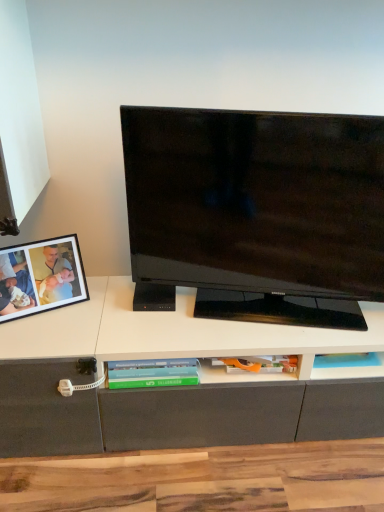
What is the approximate width of matte black picture frame at left?

It is 1.71 inches.

This screenshot has width=384, height=512. What do you see at coordinates (153, 373) in the screenshot?
I see `green matte book at center` at bounding box center [153, 373].

The image size is (384, 512). Describe the element at coordinates (256, 213) in the screenshot. I see `black glossy television at center` at that location.

The height and width of the screenshot is (512, 384). In order to click on matte black picture frame at left in this screenshot , I will do `click(41, 277)`.

Visually, is black glossy television at center positioned to the left or to the right of green matte book at center?

Clearly, black glossy television at center is on the right of green matte book at center in the image.

Is black glossy television at center oriented towards green matte book at center?

No, black glossy television at center does not turn towards green matte book at center.

Looking at their sizes, would you say matte black picture frame at left is wider or thinner than black glossy television at center?

matte black picture frame at left is thinner than black glossy television at center.

Considering the sizes of objects matte black picture frame at left and black glossy television at center in the image provided, who is smaller, matte black picture frame at left or black glossy television at center?

matte black picture frame at left.

From a real-world perspective, is matte black picture frame at left positioned over black glossy television at center based on gravity?

No, from a real-world perspective, matte black picture frame at left is not on top of black glossy television at center.

Based on the photo, in terms of height, does matte black picture frame at left look taller or shorter compared to black glossy television at center?

In the image, matte black picture frame at left appears to be shorter than black glossy television at center.

Which of these two, black glossy television at center or matte black picture frame at left, is wider?

black glossy television at center is wider.

Is black glossy television at center not inside matte black picture frame at left?

Absolutely, black glossy television at center is external to matte black picture frame at left.

Is black glossy television at center aimed at matte black picture frame at left?

No, black glossy television at center is not oriented towards matte black picture frame at left.

Considering the positions of point (170, 376) and point (201, 300), is point (170, 376) closer or farther from the camera than point (201, 300)?

Point (170, 376).

From a real-world perspective, is green matte book at center positioned above or below black glossy television at center?

In terms of real-world spatial position, green matte book at center is below black glossy television at center.

From the image's perspective, which object appears higher, green matte book at center or black glossy television at center?

black glossy television at center is shown above in the image.

Consider the image. Is green matte book at center wider than black glossy television at center?

Indeed, green matte book at center has a greater width compared to black glossy television at center.

In the scene shown: From the image's perspective, which one is positioned higher, matte black picture frame at left or green matte book at center?

matte black picture frame at left.

Does matte black picture frame at left have a greater width compared to green matte book at center?

Incorrect, the width of matte black picture frame at left does not surpass that of green matte book at center.

Consider the image. Between matte black picture frame at left and green matte book at center, which one has smaller size?

Smaller between the two is green matte book at center.

How much distance is there between matte black picture frame at left and green matte book at center?

matte black picture frame at left and green matte book at center are 13.84 inches apart.

Who is more distant, green matte book at center or matte black picture frame at left?

green matte book at center is more distant.

Does green matte book at center turn towards matte black picture frame at left?

A: No, green matte book at center is not turned towards matte black picture frame at left.

In the image, is green matte book at center on the left side or the right side of matte black picture frame at left?

Clearly, green matte book at center is on the right of matte black picture frame at left in the image.

Considering the relative sizes of green matte book at center and matte black picture frame at left in the image provided, is green matte book at center wider than matte black picture frame at left?

Yes.

This screenshot has height=512, width=384. In order to click on book that is on the left side of black glossy television at center in this screenshot , I will do `click(153, 373)`.

The image size is (384, 512). I want to click on television above the matte black picture frame at left (from a real-world perspective), so click(x=256, y=213).

Based on their spatial positions, is black glossy television at center or green matte book at center further from matte black picture frame at left?

black glossy television at center is further to matte black picture frame at left.

Based on their spatial positions, is matte black picture frame at left or green matte book at center further from black glossy television at center?

Based on the image, matte black picture frame at left appears to be further to black glossy television at center.

Estimate the real-world distances between objects in this image. Which object is closer to matte black picture frame at left, green matte book at center or black glossy television at center?

The object closer to matte black picture frame at left is green matte book at center.

Based on their spatial positions, is matte black picture frame at left or black glossy television at center closer to green matte book at center?

matte black picture frame at left is positioned closer to the anchor green matte book at center.

Based on their spatial positions, is green matte book at center or matte black picture frame at left closer to black glossy television at center?

green matte book at center is positioned closer to the anchor black glossy television at center.

From the image, which object appears to be farther from green matte book at center, black glossy television at center or matte black picture frame at left?

black glossy television at center lies further to green matte book at center than the other object.

The height and width of the screenshot is (512, 384). What are the coordinates of `book situated between matte black picture frame at left and black glossy television at center from left to right` in the screenshot? It's located at (153, 373).